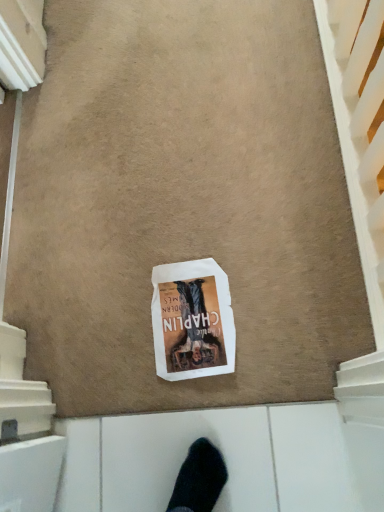
At what (x,y) coordinates should I click in order to perform the action: click on unoccupied region to the right of white paper bag at center. Please return your answer as a coordinate pair (x, y). The image size is (384, 512). Looking at the image, I should click on (270, 289).